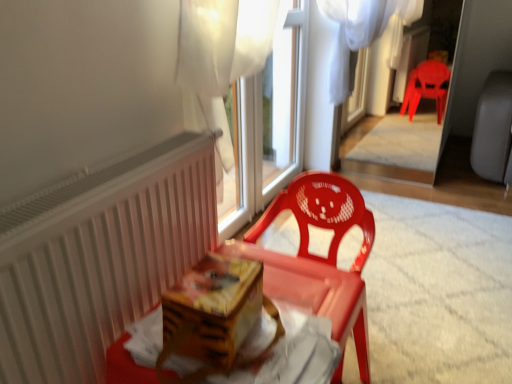
Question: From the image's perspective, does matte plastic chair at center appear higher than white matte radiator at left?

Choices:
 (A) yes
 (B) no

Answer: (B)

Question: Is matte plastic chair at center aimed at white matte radiator at left?

Choices:
 (A) yes
 (B) no

Answer: (A)

Question: Is the position of matte plastic chair at center less distant than that of white matte radiator at left?

Choices:
 (A) yes
 (B) no

Answer: (B)

Question: From a real-world perspective, is matte plastic chair at center positioned under white matte radiator at left based on gravity?

Choices:
 (A) yes
 (B) no

Answer: (A)

Question: From the image's perspective, is matte plastic chair at center beneath white matte radiator at left?

Choices:
 (A) no
 (B) yes

Answer: (B)

Question: Does matte plastic chair at center have a lesser width compared to white matte radiator at left?

Choices:
 (A) yes
 (B) no

Answer: (B)

Question: Is wooden at center at the right side of white matte radiator at left?

Choices:
 (A) no
 (B) yes

Answer: (B)

Question: Is wooden at center next to white matte radiator at left and touching it?

Choices:
 (A) yes
 (B) no

Answer: (B)

Question: From a real-world perspective, is wooden at center under white matte radiator at left?

Choices:
 (A) no
 (B) yes

Answer: (A)

Question: From the image's perspective, is wooden at center on top of white matte radiator at left?

Choices:
 (A) yes
 (B) no

Answer: (B)

Question: Can you confirm if wooden at center is shorter than white matte radiator at left?

Choices:
 (A) yes
 (B) no

Answer: (A)

Question: Can you confirm if wooden at center is wider than white matte radiator at left?

Choices:
 (A) no
 (B) yes

Answer: (B)

Question: From the image's perspective, does matte plastic chair at center appear higher than white plastic window frame at upper center?

Choices:
 (A) yes
 (B) no

Answer: (B)